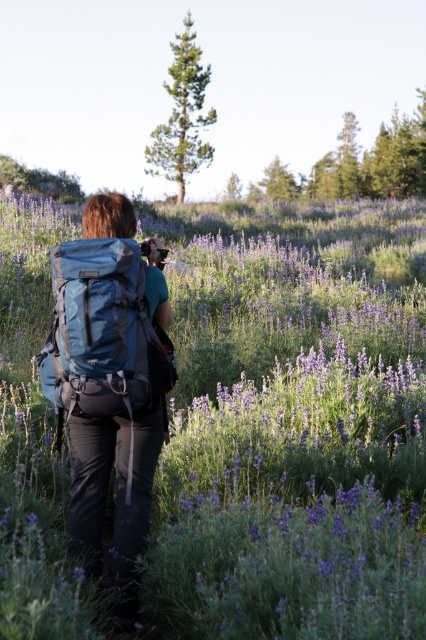
Question: Which object is positioned farthest from the matte blue backpack at center?

Choices:
 (A) purple soft lavender at center
 (B) teal fabric backpack at center

Answer: (A)

Question: Considering the real-world distances, which object is farthest from the purple soft lavender at center?

Choices:
 (A) teal fabric backpack at center
 (B) matte blue backpack at center

Answer: (B)

Question: Is matte blue backpack at center smaller than teal fabric backpack at center?

Choices:
 (A) yes
 (B) no

Answer: (B)

Question: Which point is farther to the camera?

Choices:
 (A) teal fabric backpack at center
 (B) matte blue backpack at center

Answer: (B)

Question: Does purple soft lavender at center appear on the left side of matte blue backpack at center?

Choices:
 (A) yes
 (B) no

Answer: (B)

Question: Is matte blue backpack at center below teal fabric backpack at center?

Choices:
 (A) yes
 (B) no

Answer: (A)